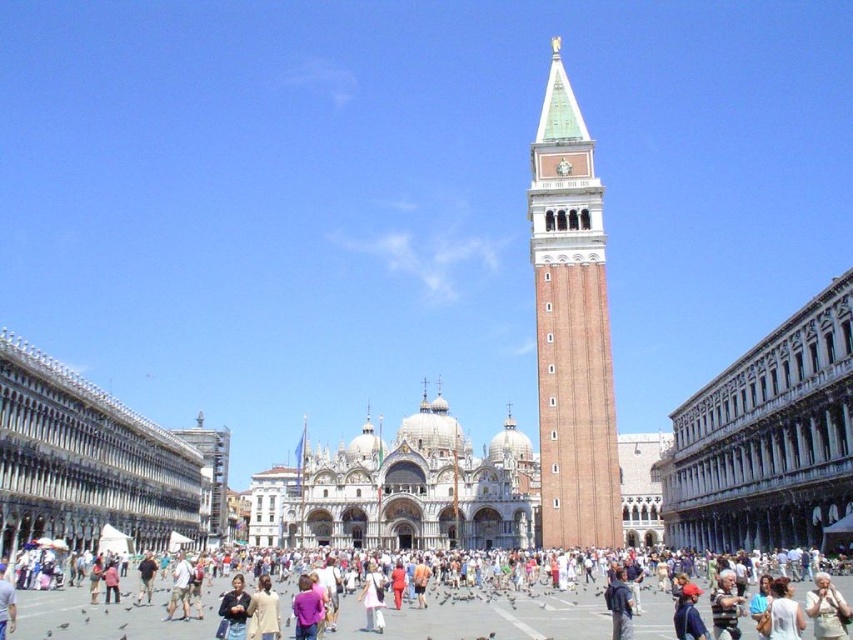
Does light beige cotton shirt at center have a greater width compared to dark blue sweater at center?

Correct, the width of light beige cotton shirt at center exceeds that of dark blue sweater at center.

Who is more forward, (546, 593) or (219, 621)?

Point (219, 621) is in front.

The image size is (853, 640). I want to click on light beige cotton shirt at center, so click(489, 618).

Find the location of `light beige cotton shirt at center`. light beige cotton shirt at center is located at coordinates (489, 618).

Who is positioned more to the left, brown brick tower at center or light beige cotton shirt at center?

Positioned to the left is light beige cotton shirt at center.

Does point (606, 417) come in front of point (80, 618)?

That is False.

What do you see at coordinates (572, 328) in the screenshot?
I see `brown brick tower at center` at bounding box center [572, 328].

Locate an element on the screen. This screenshot has height=640, width=853. brown brick tower at center is located at coordinates [x=572, y=328].

Can you confirm if brown brick tower at center is smaller than dark blue sweater at center?

No.

Between brown brick tower at center and dark blue sweater at center, which one is positioned higher?

brown brick tower at center is above.

Is point (608, 385) more distant than point (231, 634)?

That is True.

At what (x,y) coordinates should I click in order to perform the action: click on brown brick tower at center. Please return your answer as a coordinate pair (x, y). Looking at the image, I should click on (572, 328).